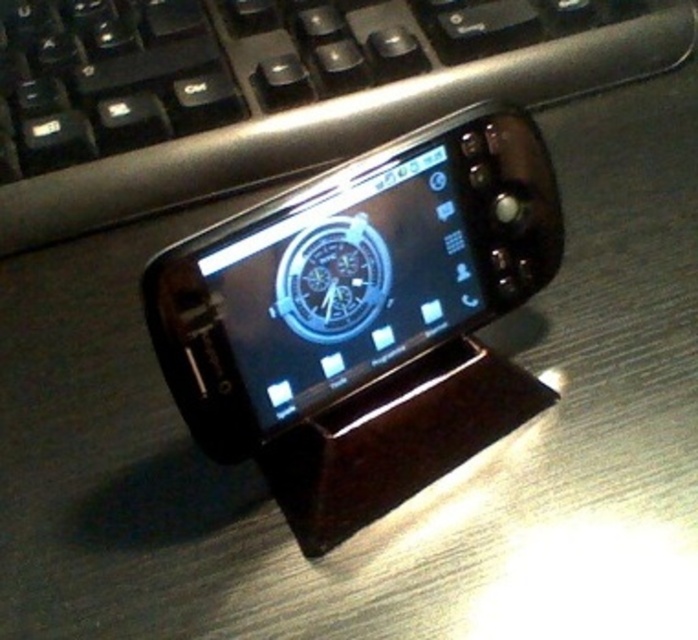
Question: Is the position of black plastic keyboard at upper center less distant than that of satin black smartphone at center?

Choices:
 (A) no
 (B) yes

Answer: (A)

Question: From the image, what is the correct spatial relationship of black plastic keyboard at upper center in relation to satin black smartphone at center?

Choices:
 (A) above
 (B) below

Answer: (A)

Question: Among these points, which one is farthest from the camera?

Choices:
 (A) (50, 58)
 (B) (193, 385)

Answer: (A)

Question: Among these points, which one is farthest from the camera?

Choices:
 (A) click(341, 243)
 (B) click(20, 74)

Answer: (B)

Question: Is black plastic keyboard at upper center to the left of satin black smartphone at center from the viewer's perspective?

Choices:
 (A) yes
 (B) no

Answer: (A)